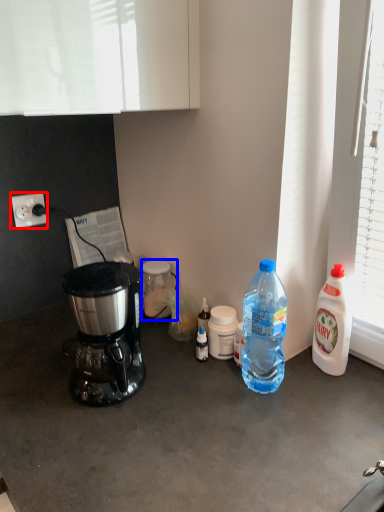
Question: Which of the following is the farthest to the observer, power outlet (highlighted by a red box) or bottle (highlighted by a blue box)?

Choices:
 (A) power outlet
 (B) bottle

Answer: (B)